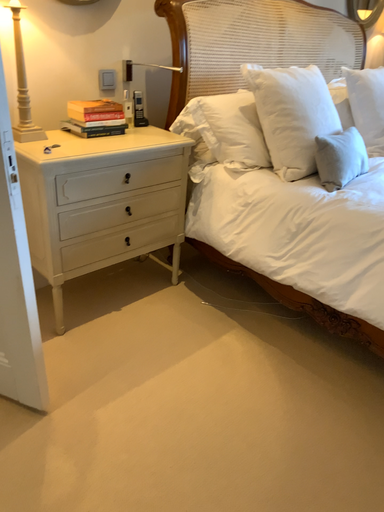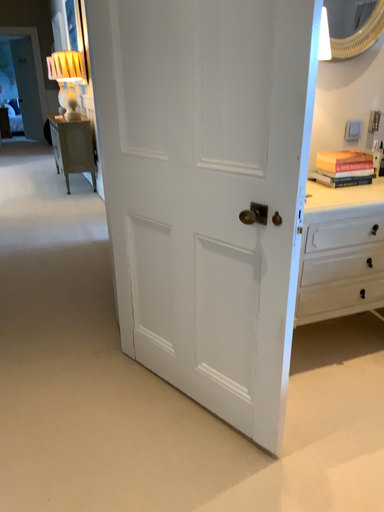
Question: How did the camera likely rotate when shooting the video?

Choices:
 (A) rotated left
 (B) rotated right

Answer: (A)